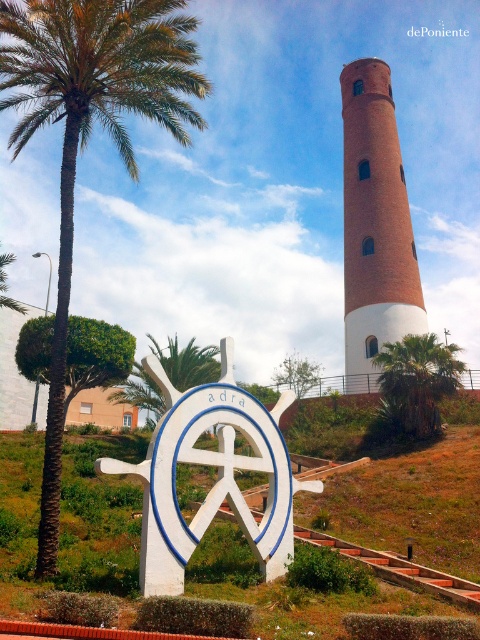
Is white matte sign at center to the left of brick tower at center from the viewer's perspective?

Indeed, white matte sign at center is positioned on the left side of brick tower at center.

Is point (162, 499) behind point (371, 88)?

That is False.

Where is `white matte sign at center`? white matte sign at center is located at coordinates (217, 476).

How distant is green leafy palm tree at left from white matte sign at center?

5.01 meters

Is green leafy palm tree at left below white matte sign at center?

No, green leafy palm tree at left is not below white matte sign at center.

Which is in front, point (8, 29) or point (271, 579)?

Point (271, 579) is in front.

Identify the location of green leafy palm tree at left. Image resolution: width=480 pixels, height=640 pixels. (90, 132).

Is point (124, 56) positioned after point (345, 237)?

That is False.

Is green leafy palm tree at left wider than brick tower at center?

Yes, green leafy palm tree at left is wider than brick tower at center.

Locate an element on the screen. Image resolution: width=480 pixels, height=640 pixels. green leafy palm tree at left is located at coordinates (90, 132).

The height and width of the screenshot is (640, 480). In order to click on green leafy palm tree at left in this screenshot , I will do `click(90, 132)`.